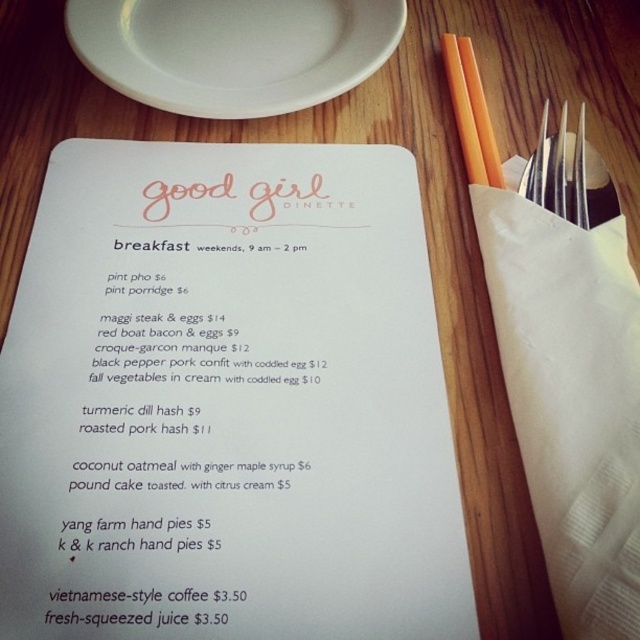
Question: Is white ceramic plate at upper left below orange plastic chopsticks at upper right?

Choices:
 (A) no
 (B) yes

Answer: (A)

Question: Which point appears farthest from the camera in this image?

Choices:
 (A) (545, 124)
 (B) (442, 49)
 (C) (134, 40)

Answer: (B)

Question: Which point is farther to the camera?

Choices:
 (A) orange plastic chopsticks at upper right
 (B) silver metallic fork at upper right
 (C) white ceramic plate at upper left

Answer: (C)

Question: Is white ceramic plate at upper left thinner than silver metallic fork at upper right?

Choices:
 (A) yes
 (B) no

Answer: (B)

Question: Among these objects, which one is nearest to the camera?

Choices:
 (A) white ceramic plate at upper left
 (B) silver metallic fork at upper right
 (C) orange plastic chopsticks at upper right

Answer: (B)

Question: Does silver metallic fork at upper right have a greater width compared to orange plastic chopsticks at upper right?

Choices:
 (A) no
 (B) yes

Answer: (B)